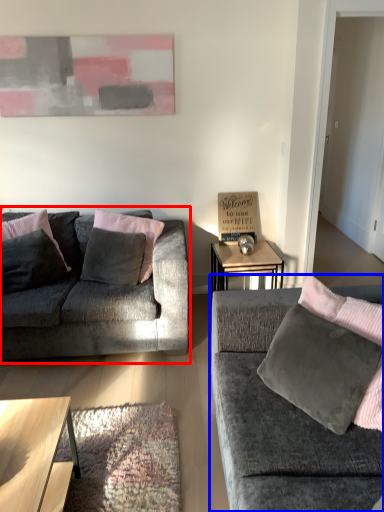
Question: Which object is further to the camera taking this photo, studio couch (highlighted by a red box) or studio couch (highlighted by a blue box)?

Choices:
 (A) studio couch
 (B) studio couch

Answer: (A)